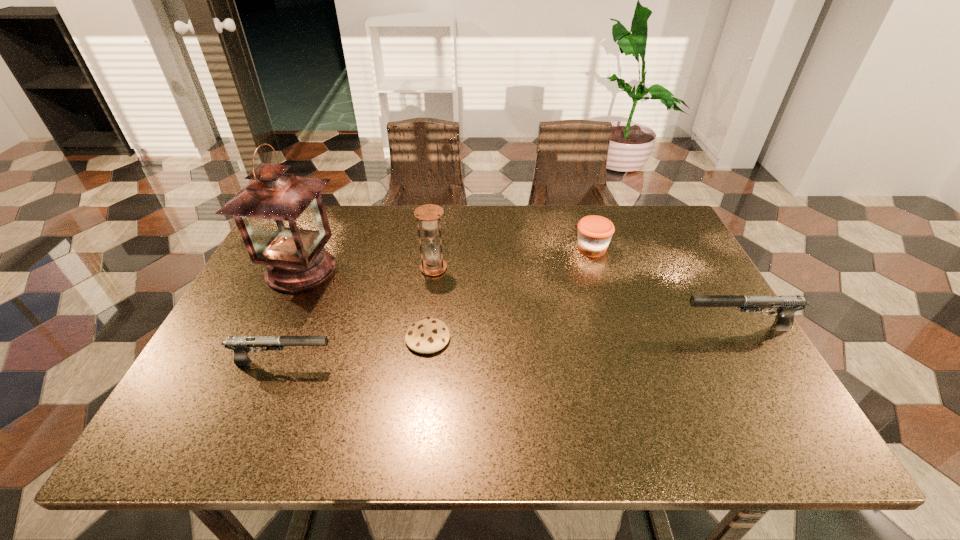
At what (x,y) coordinates should I click in order to perform the action: click on vacant point located between the jam and the oil lamp. Please return your answer as a coordinate pair (x, y). Looking at the image, I should click on (446, 259).

At what (x,y) coordinates should I click in order to perform the action: click on free point between the fifth shortest object and the tallest object. Please return your answer as a coordinate pair (x, y). The height and width of the screenshot is (540, 960). Looking at the image, I should click on (368, 269).

Find the location of a particular element. Image resolution: width=960 pixels, height=540 pixels. vacant area between the second tallest object and the tallest object is located at coordinates 368,269.

The image size is (960, 540). Find the location of `vacant region between the fifth object from left to right and the shorter gun`. vacant region between the fifth object from left to right and the shorter gun is located at coordinates (438, 306).

Find the location of a particular element. free spot between the cookie and the shorter gun is located at coordinates (355, 350).

Find the location of `vacant area that lies between the rightmost object and the tallest object`. vacant area that lies between the rightmost object and the tallest object is located at coordinates (519, 299).

Locate an element on the screen. The width and height of the screenshot is (960, 540). free space between the jam and the shorter gun is located at coordinates (438, 306).

Find the location of a particular element. The width and height of the screenshot is (960, 540). object that is the third closest to the shortest object is located at coordinates (281, 217).

You are a GUI agent. You are given a task and a screenshot of the screen. Output one action in this format:
    pyautogui.click(x=<x>, y=<y>)
    Task: Click on the object that stands as the fifth closest to the rightmost object
    This screenshot has width=960, height=540.
    Given the screenshot: What is the action you would take?
    pyautogui.click(x=281, y=217)

Locate an element on the screen. vacant point that satisfies the following two spatial constraints: 1. on the front label of the jam; 2. at the muzzle end of the nearest object is located at coordinates (628, 362).